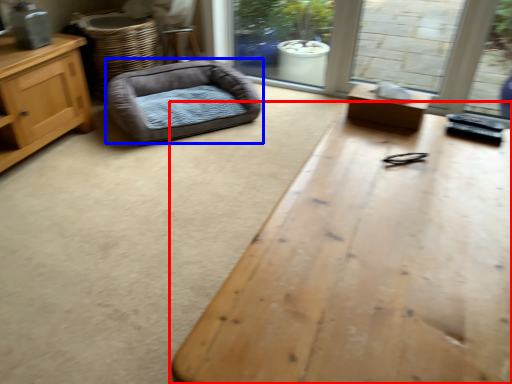
Question: Which point is closer to the camera, table (highlighted by a red box) or dog bed (highlighted by a blue box)?

Choices:
 (A) table
 (B) dog bed

Answer: (A)